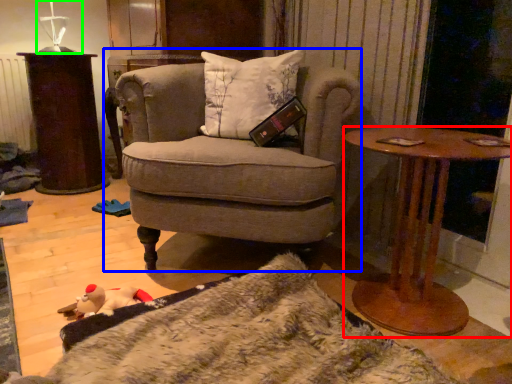
Question: Based on their relative distances, which object is nearer to desk (highlighted by a red box)? Choose from chair (highlighted by a blue box) and table lamp (highlighted by a green box).

Choices:
 (A) chair
 (B) table lamp

Answer: (A)